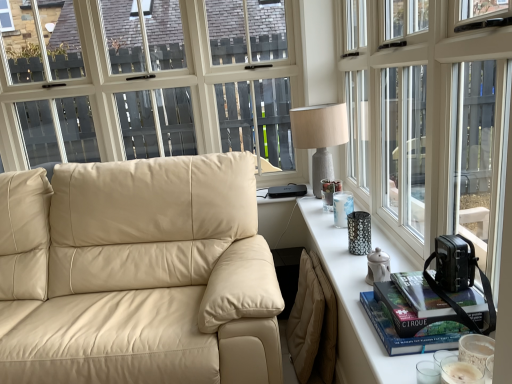
Identify the location of blank space situated above hardcover book at right, arranged as the second book when ordered from the bottom (from a real-world perspective). (431, 286).